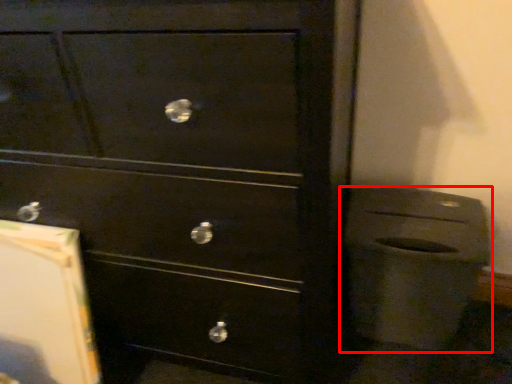
Question: Considering the relative positions of waste container (annotated by the red box) and chest of drawers in the image provided, where is waste container (annotated by the red box) located with respect to the staircase?

Choices:
 (A) left
 (B) right

Answer: (B)